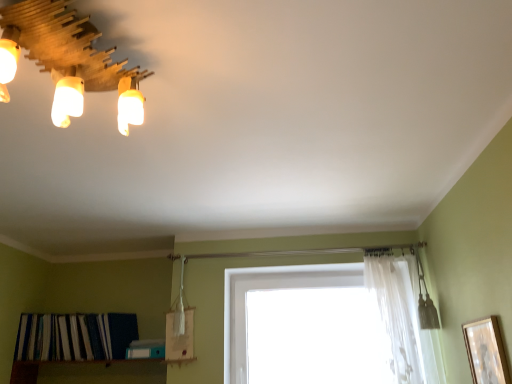
Question: Is wooden picture frame at right aimed at white sheer curtain at upper center?

Choices:
 (A) yes
 (B) no

Answer: (B)

Question: Considering the relative sizes of wooden picture frame at right and white sheer curtain at upper center in the image provided, is wooden picture frame at right smaller than white sheer curtain at upper center?

Choices:
 (A) no
 (B) yes

Answer: (B)

Question: Is wooden picture frame at right shorter than white sheer curtain at upper center?

Choices:
 (A) yes
 (B) no

Answer: (A)

Question: Is white sheer curtain at upper center completely or partially inside wooden picture frame at right?

Choices:
 (A) no
 (B) yes

Answer: (A)

Question: Is wooden picture frame at right at the left side of white sheer curtain at upper center?

Choices:
 (A) no
 (B) yes

Answer: (A)

Question: Is wooden picture frame at right bigger than white sheer curtain at upper center?

Choices:
 (A) no
 (B) yes

Answer: (A)

Question: Is transparent glass window at center a part of wooden picture frame at right?

Choices:
 (A) yes
 (B) no

Answer: (B)

Question: From the image's perspective, is wooden picture frame at right above transparent glass window at center?

Choices:
 (A) yes
 (B) no

Answer: (A)

Question: From a real-world perspective, is wooden picture frame at right on top of transparent glass window at center?

Choices:
 (A) yes
 (B) no

Answer: (B)

Question: Does wooden picture frame at right appear on the left side of transparent glass window at center?

Choices:
 (A) no
 (B) yes

Answer: (A)

Question: From a real-world perspective, is wooden picture frame at right positioned under transparent glass window at center based on gravity?

Choices:
 (A) no
 (B) yes

Answer: (B)

Question: Considering the relative sizes of wooden picture frame at right and transparent glass window at center in the image provided, is wooden picture frame at right taller than transparent glass window at center?

Choices:
 (A) yes
 (B) no

Answer: (B)

Question: Considering the relative sizes of white sheer curtain at upper center and transparent glass window at center in the image provided, is white sheer curtain at upper center thinner than transparent glass window at center?

Choices:
 (A) yes
 (B) no

Answer: (B)